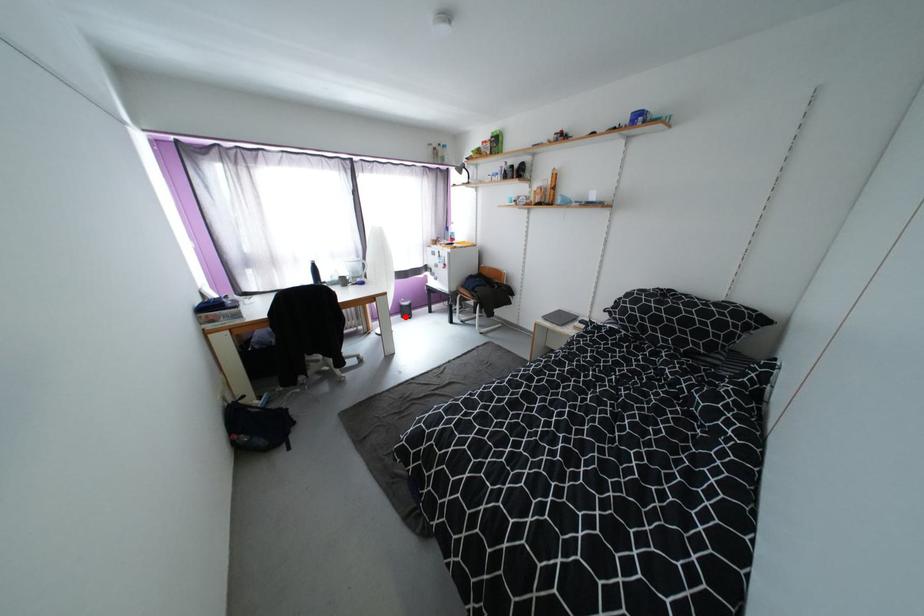
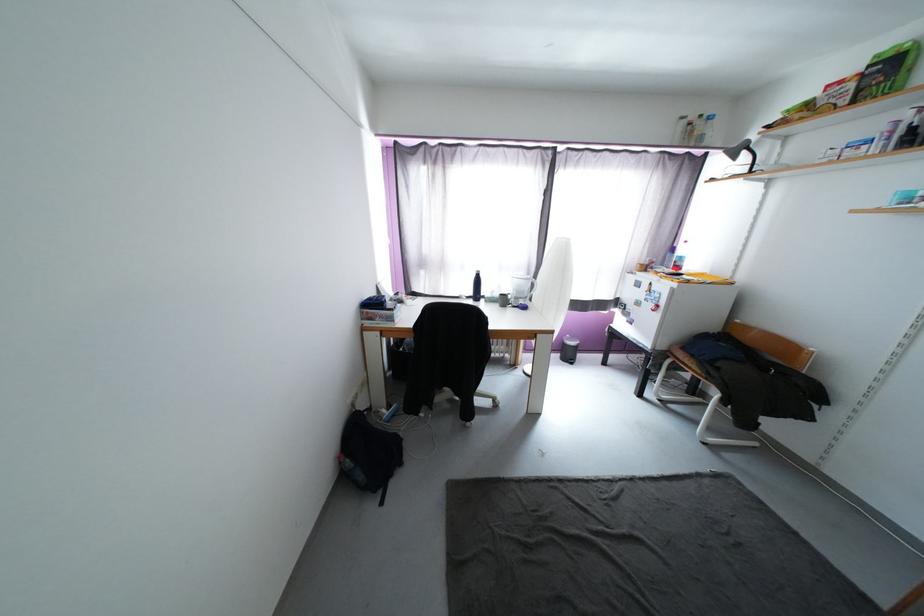
The point at the highlighted location is marked in the first image. Where is the corresponding point in the second image?

(564, 357)